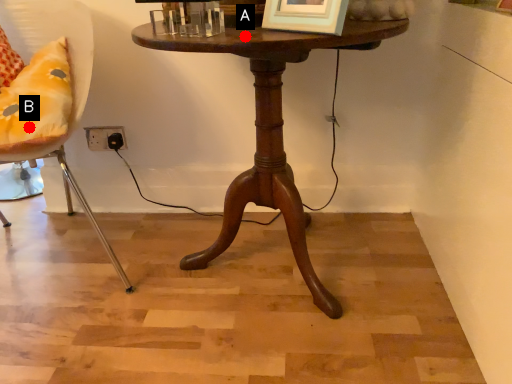
Question: Two points are circled on the image, labeled by A and B beside each circle. Which point is further to the camera?

Choices:
 (A) A is further
 (B) B is further

Answer: (B)